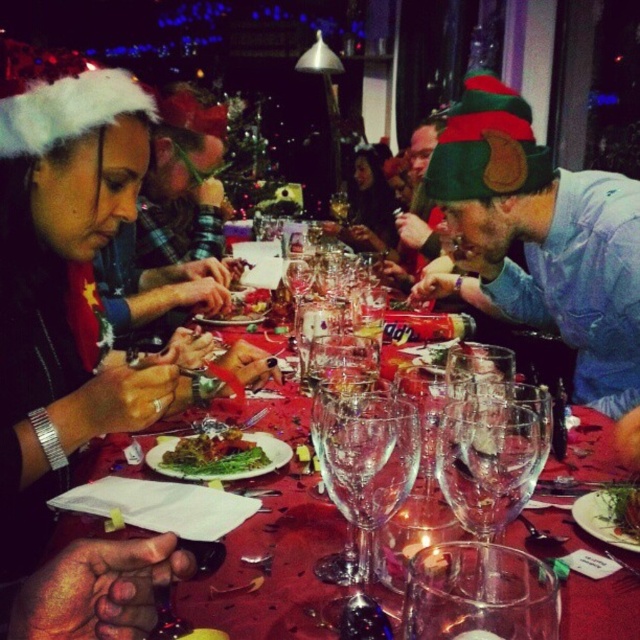
Which is below, green felt hat at upper right or matte black santa hat at left?

green felt hat at upper right

Which of these two, green felt hat at upper right or matte black santa hat at left, stands taller?

matte black santa hat at left is taller.

Between point (570, 317) and point (134, 284), which one is positioned in front?

Positioned in front is point (570, 317).

You are a GUI agent. You are given a task and a screenshot of the screen. Output one action in this format:
    pyautogui.click(x=<x>, y=<y>)
    Task: Click on the green felt hat at upper right
    The image size is (640, 640).
    Given the screenshot: What is the action you would take?
    pyautogui.click(x=545, y=237)

Who is shorter, transparent glass wine glass at center or green leafy salad at center?

Standing shorter between the two is green leafy salad at center.

Does transparent glass wine glass at center have a smaller size compared to green leafy salad at center?

Actually, transparent glass wine glass at center might be larger than green leafy salad at center.

Is point (324, 420) positioned after point (612, 529)?

No, it is in front of (612, 529).

The width and height of the screenshot is (640, 640). Find the location of `transparent glass wine glass at center`. transparent glass wine glass at center is located at coordinates pyautogui.click(x=365, y=468).

Is matte black santa hat at left to the left of green leafymaterial/texturevegetable at center from the viewer's perspective?

Correct, you'll find matte black santa hat at left to the left of green leafymaterial/texturevegetable at center.

Does matte black santa hat at left have a greater width compared to green leafymaterial/texturevegetable at center?

Yes.

Find the location of a particular element. This screenshot has height=640, width=640. matte black santa hat at left is located at coordinates (170, 230).